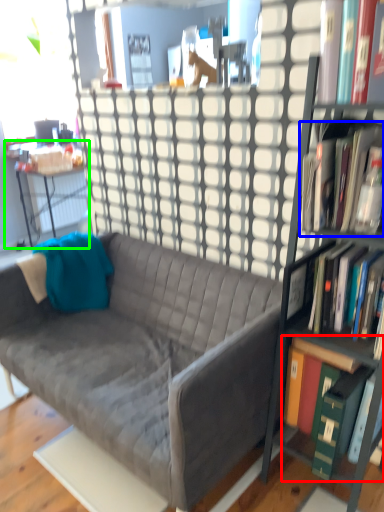
Question: Which object is the farthest from book (highlighted by a red box)? Choose among these: book (highlighted by a blue box) or desk (highlighted by a green box).

Choices:
 (A) book
 (B) desk

Answer: (B)